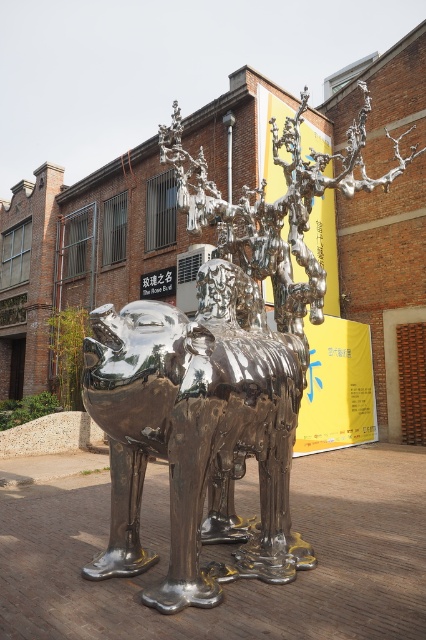
Which of these two, shiny metallic deer at center or shiny metallic camel at center, stands shorter?

shiny metallic camel at center

Which is more to the left, shiny metallic deer at center or shiny metallic camel at center?

shiny metallic camel at center is more to the left.

Who is more distant from viewer, (137, 436) or (111, 477)?

The point (111, 477) is more distant.

The height and width of the screenshot is (640, 426). Find the location of `shiny metallic deer at center`. shiny metallic deer at center is located at coordinates (218, 372).

Does shiny metallic deer at center have a greater height compared to green leafy plant at left?

Yes.

Looking at this image, who is more forward, (207, 420) or (63, 326)?

Point (207, 420) is in front.

Image resolution: width=426 pixels, height=640 pixels. In order to click on shiny metallic deer at center in this screenshot , I will do `click(218, 372)`.

Who is positioned more to the right, shiny metallic camel at center or green leafy plant at left?

Positioned to the right is shiny metallic camel at center.

Is point (227, 268) positioned in front of point (60, 333)?

Yes, it is.

Locate an element on the screen. shiny metallic camel at center is located at coordinates (196, 433).